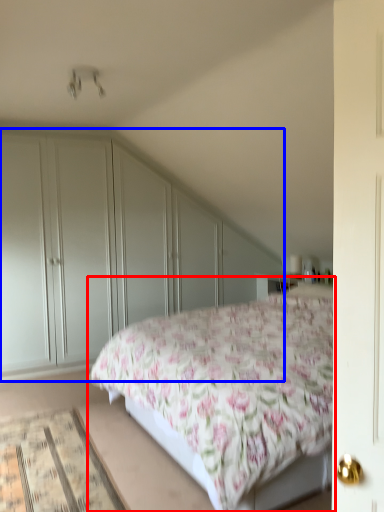
Question: Which point is closer to the camera, bed (highlighted by a red box) or dresser (highlighted by a blue box)?

Choices:
 (A) bed
 (B) dresser

Answer: (A)